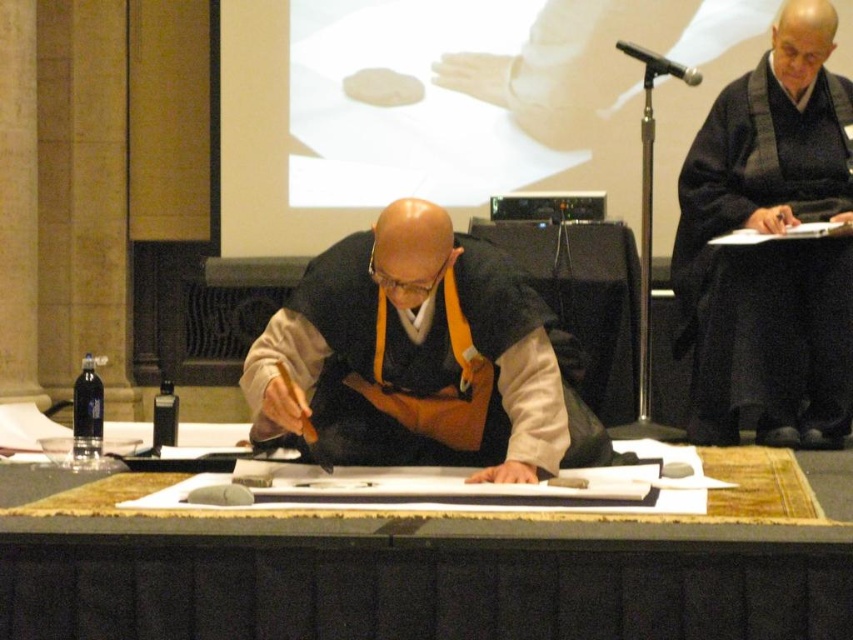
You are a guest at this event and want to approach the wooden table at center to observe the writing process. However, you must ensure that you do not come closer than 1.2 meters to the black matte robe at upper right, which belongs to a respected figure. Can you safely approach the table without violating this distance requirement?

The distance between the wooden table at center and the black matte robe at upper right is 1.33 meters. Since the required minimum distance is 1.2 meters, you can safely approach the table as the existing distance exceeds the required 1.2 meters.

Looking at this image, you are attending a cultural event and notice two people wearing robes. The first is wearing a matte black robe at center, and the other is wearing a black matte robe at upper right. From your perspective, which robe is positioned to the left?

The matte black robe at center is positioned to the left of the black matte robe at upper right.

You are a guest at this event and need to place a small gift on the wooden table at center without touching the matte black robe at center. Is the table tall enough for this?

The wooden table at center has a lesser height compared to matte black robe at center, meaning the table is shorter. Since the robe is taller, placing the gift on the table might require caution to avoid the robe blocking access, but the height difference alone doesn